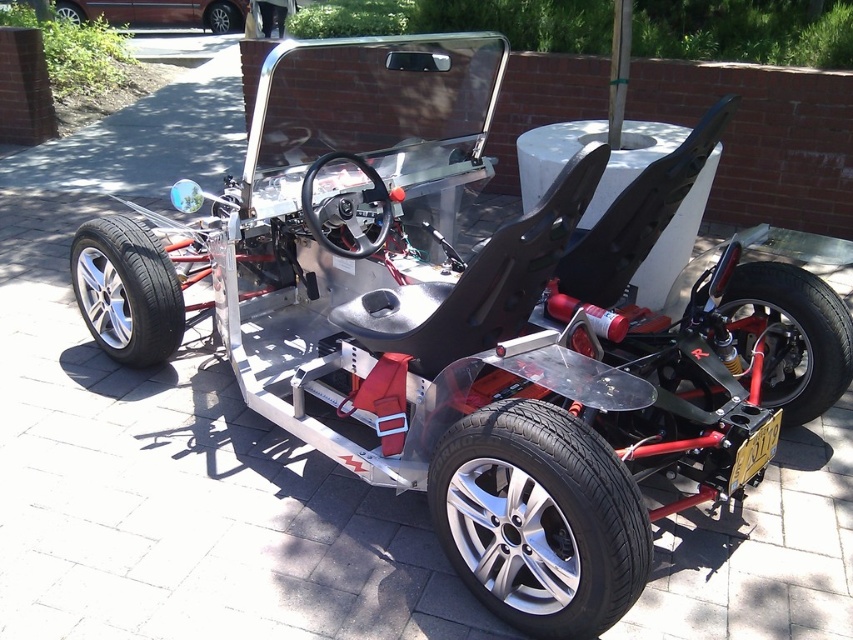
You are a mechanic inspecting a go kart. You need to check the metallic maroon van at upper left and the silver metallic wheel at center. Which object is nearer to you?

The metallic maroon van at upper left is closer to the viewer than the silver metallic wheel at center.

You are a mechanic inspecting the metallic maroon van at upper left and the silver metallic wheel at center in the image. Which object is taller?

The metallic maroon van at upper left is much taller than the silver metallic wheel at center.